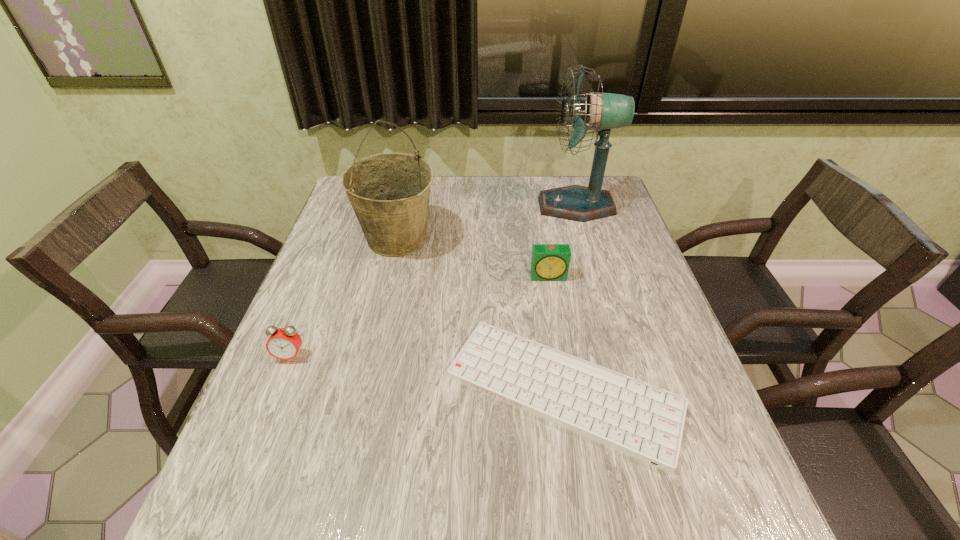
This screenshot has height=540, width=960. Identify the location of computer keyboard that is positioned at the right edge. (643, 421).

Image resolution: width=960 pixels, height=540 pixels. I want to click on object located in the far left corner section of the desktop, so click(389, 192).

Locate an element on the screen. object present at the far right corner is located at coordinates (603, 111).

At what (x,y) coordinates should I click in order to perform the action: click on vacant space at the far edge of the desktop. Please return your answer as a coordinate pair (x, y). Looking at the image, I should click on (480, 191).

You are a GUI agent. You are given a task and a screenshot of the screen. Output one action in this format:
    pyautogui.click(x=<x>, y=<y>)
    Task: Click on the free space at the left edge of the desktop
    
    Given the screenshot: What is the action you would take?
    pyautogui.click(x=322, y=420)

Where is `vacant space at the near left corner of the desktop`? Image resolution: width=960 pixels, height=540 pixels. vacant space at the near left corner of the desktop is located at coordinates (213, 505).

This screenshot has width=960, height=540. Find the location of `vacant area at the far right corner`. vacant area at the far right corner is located at coordinates (575, 181).

You are a GUI agent. You are given a task and a screenshot of the screen. Output one action in this format:
    pyautogui.click(x=<x>, y=<y>)
    Task: Click on the free space between the wine bucket and the shortest object
    The height and width of the screenshot is (540, 960).
    Given the screenshot: What is the action you would take?
    pyautogui.click(x=480, y=315)

This screenshot has height=540, width=960. Identify the location of vacant area that lies between the farther alarm clock and the nearer alarm clock. (420, 316).

You are a GUI agent. You are given a task and a screenshot of the screen. Output one action in this format:
    pyautogui.click(x=<x>, y=<y>)
    Task: Click on the vacant space in between the nearer alarm clock and the fan
    
    Given the screenshot: What is the action you would take?
    pyautogui.click(x=433, y=281)